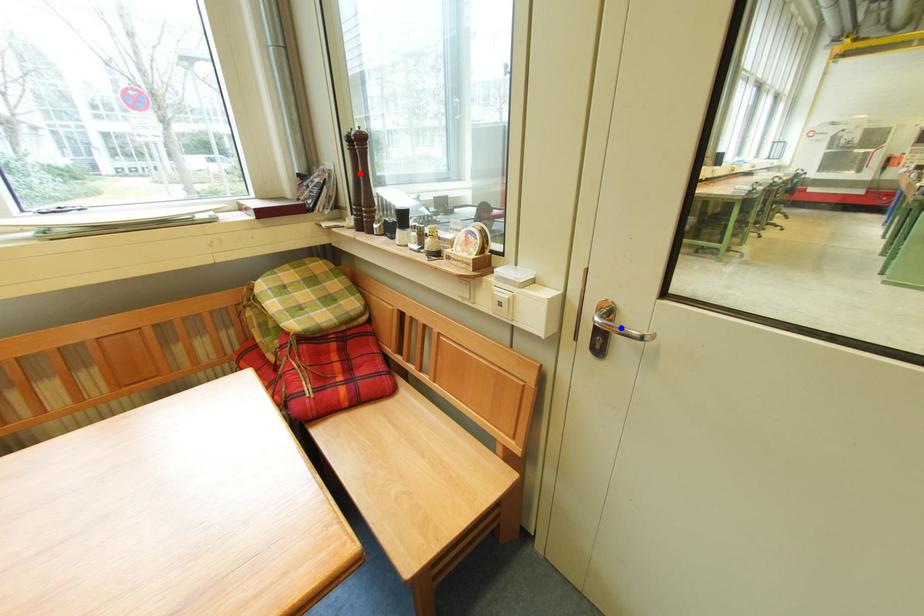
Question: Two points are marked on the image. Which point is closer to the camera?

Choices:
 (A) Blue point is closer.
 (B) Red point is closer.

Answer: (A)